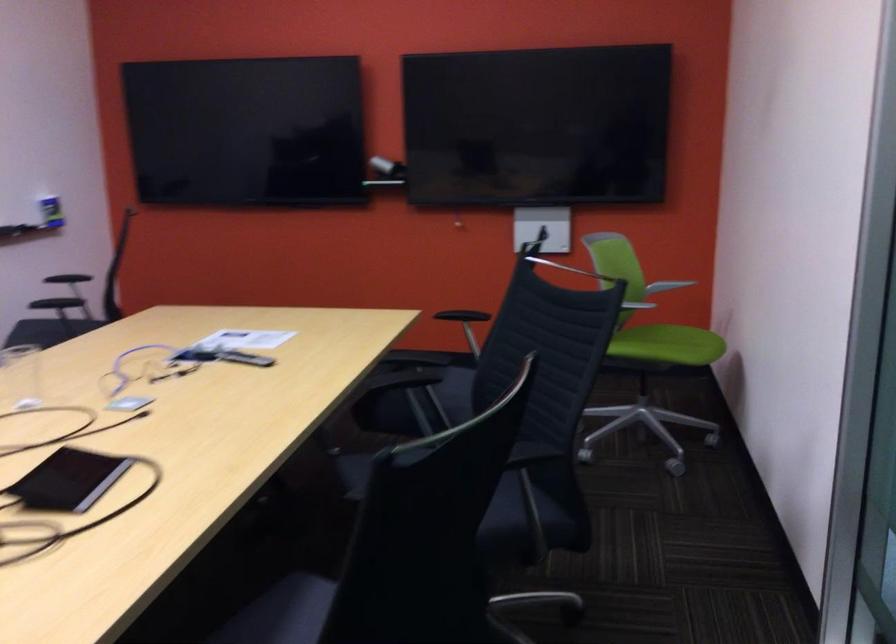
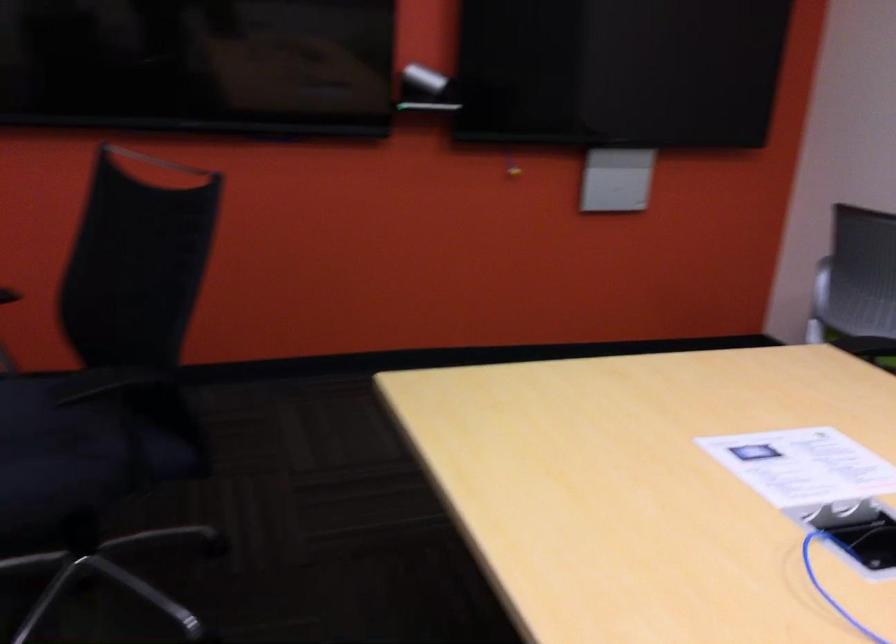
In the second image, find the point that corresponds to pixel 79 323 in the first image.

(82, 450)